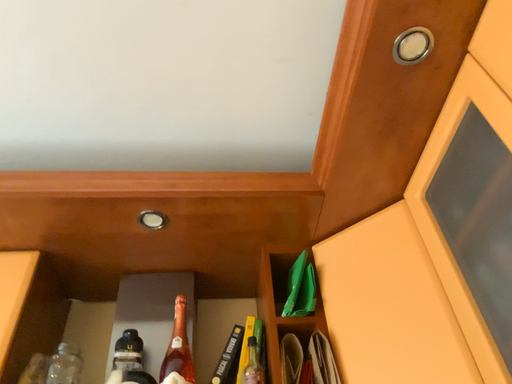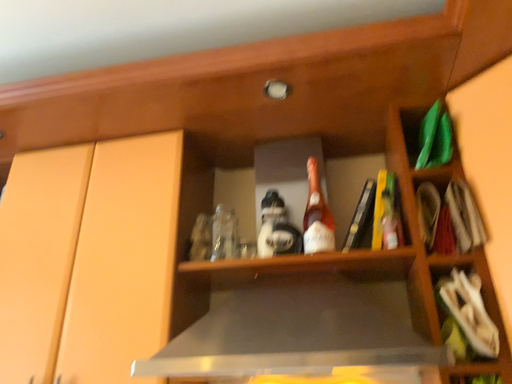
Question: Which way did the camera rotate in the video?

Choices:
 (A) rotated downward
 (B) rotated upward

Answer: (A)